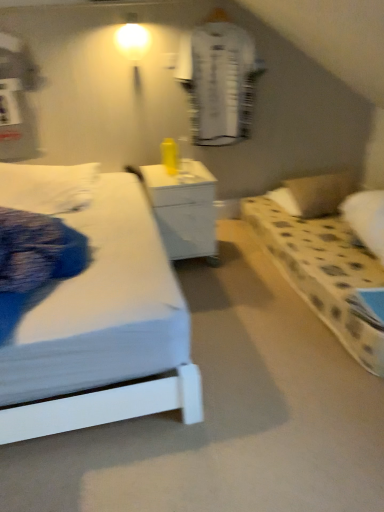
Question: Does white glossy nightstand at center lie in front of matte white bulb at upper center?

Choices:
 (A) no
 (B) yes

Answer: (B)

Question: Can you confirm if white glossy nightstand at center is wider than matte white bulb at upper center?

Choices:
 (A) yes
 (B) no

Answer: (A)

Question: Considering the relative sizes of white glossy nightstand at center and matte white bulb at upper center in the image provided, is white glossy nightstand at center taller than matte white bulb at upper center?

Choices:
 (A) yes
 (B) no

Answer: (A)

Question: Is white glossy nightstand at center further to the viewer compared to matte white bulb at upper center?

Choices:
 (A) no
 (B) yes

Answer: (A)

Question: Is matte white bulb at upper center completely or partially inside white glossy nightstand at center?

Choices:
 (A) yes
 (B) no

Answer: (B)

Question: Is white glossy nightstand at center bigger than matte white bulb at upper center?

Choices:
 (A) yes
 (B) no

Answer: (A)

Question: Is white textured robe at upper center closer to the viewer compared to matte white bulb at upper center?

Choices:
 (A) no
 (B) yes

Answer: (A)

Question: From the image's perspective, would you say white textured robe at upper center is positioned over matte white bulb at upper center?

Choices:
 (A) yes
 (B) no

Answer: (B)

Question: From a real-world perspective, is white textured robe at upper center over matte white bulb at upper center?

Choices:
 (A) no
 (B) yes

Answer: (A)

Question: Is there a large distance between white textured robe at upper center and matte white bulb at upper center?

Choices:
 (A) no
 (B) yes

Answer: (A)

Question: Is white textured robe at upper center bigger than matte white bulb at upper center?

Choices:
 (A) no
 (B) yes

Answer: (B)

Question: Is white textured robe at upper center behind matte white bulb at upper center?

Choices:
 (A) no
 (B) yes

Answer: (B)

Question: Would you say white dotted pillow at right is part of white glossy nightstand at center's contents?

Choices:
 (A) yes
 (B) no

Answer: (B)